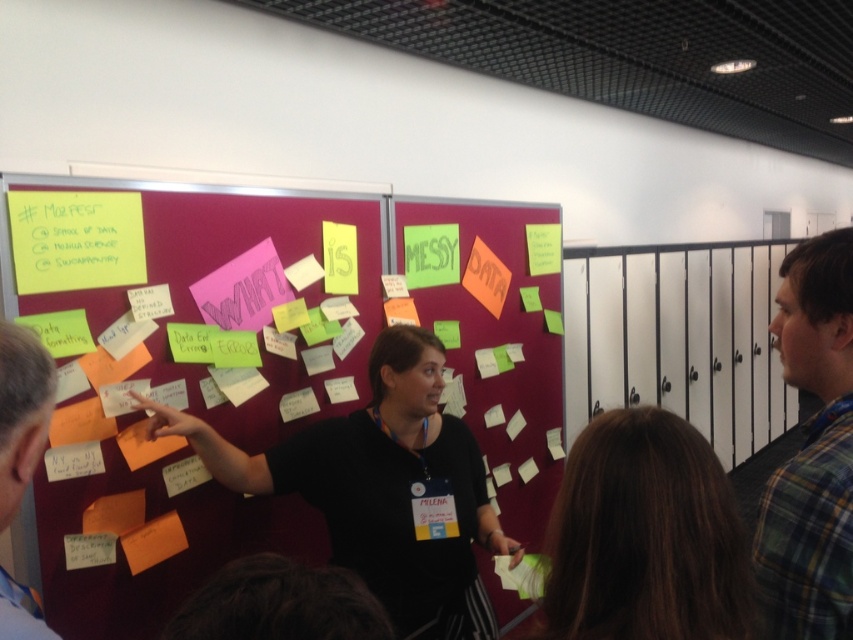
Question: Does maroon fabric bulletin board at center have a greater width compared to flannel shirt at right?

Choices:
 (A) no
 (B) yes

Answer: (B)

Question: Can you confirm if maroon fabric bulletin board at center is bigger than black shirt at center?

Choices:
 (A) no
 (B) yes

Answer: (B)

Question: Considering the relative positions of flannel shirt at right and light brown hair at left in the image provided, where is flannel shirt at right located with respect to light brown hair at left?

Choices:
 (A) above
 (B) below

Answer: (B)

Question: Which object is farther from the camera taking this photo?

Choices:
 (A) brown hair at center
 (B) black shirt at center

Answer: (B)

Question: Which object is positioned closest to the maroon fabric bulletin board at center?

Choices:
 (A) light brown hair at left
 (B) flannel shirt at right

Answer: (A)

Question: Which point is closer to the camera taking this photo?

Choices:
 (A) (669, 621)
 (B) (405, 476)
 (C) (402, 621)
 (D) (827, 337)

Answer: (A)